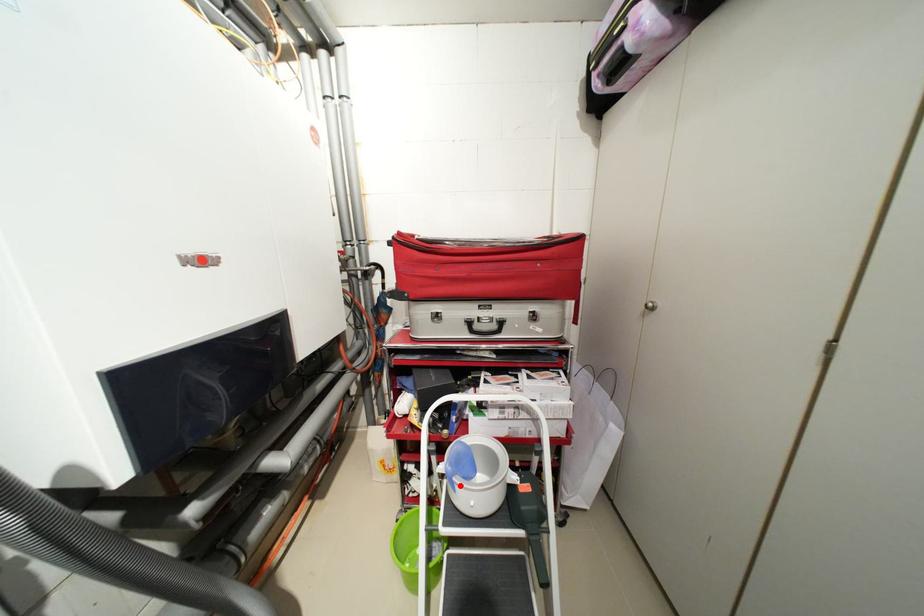
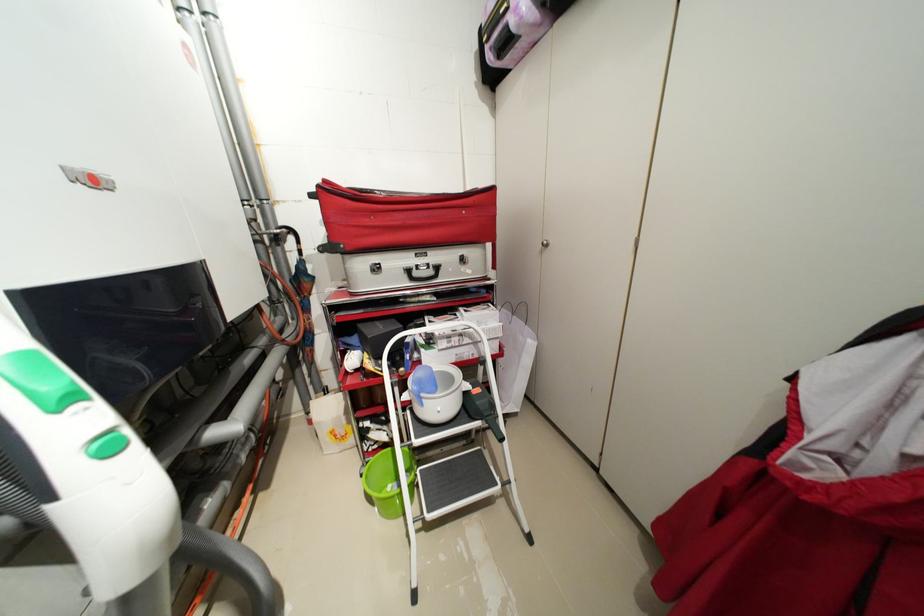
Question: I am providing you with two images of the same scene from different viewpoints. A red point is marked on the first image. At the location where the point appears in image 1, is it still visible in image 2?

Choices:
 (A) Yes
 (B) No

Answer: (A)